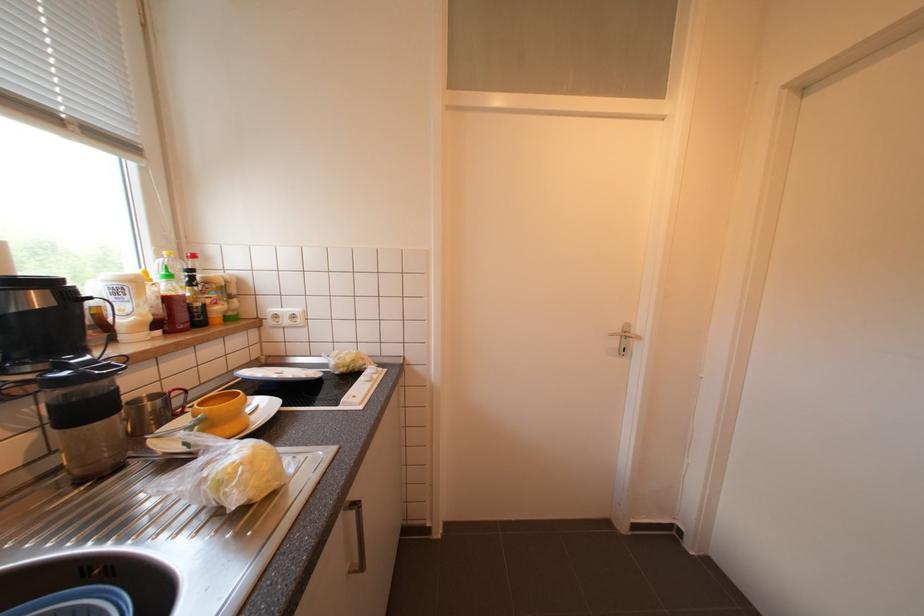
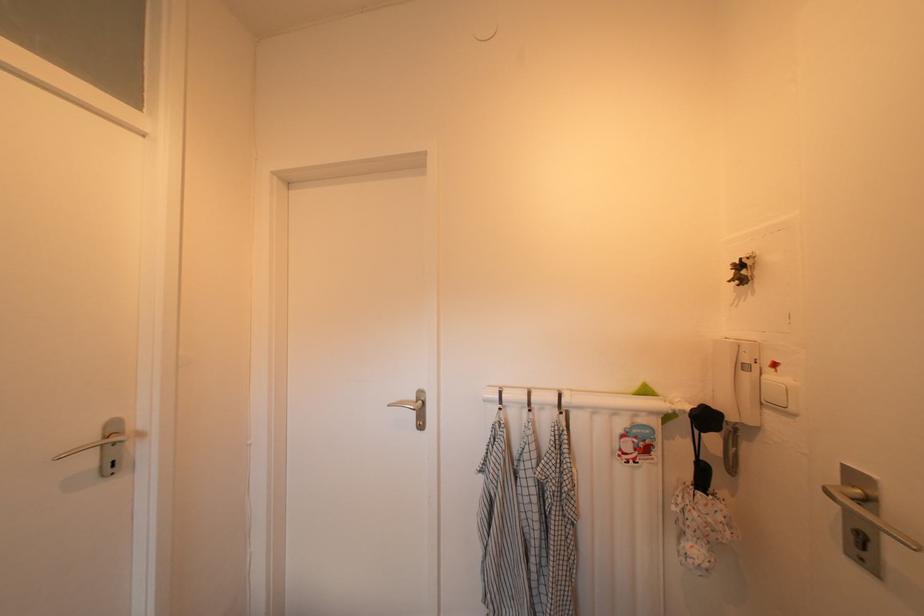
Question: Based on the continuous images, in which direction is the camera rotating? Reply with the corresponding letter.

Choices:
 (A) Left
 (B) Right
 (C) Up
 (D) Down

Answer: (B)